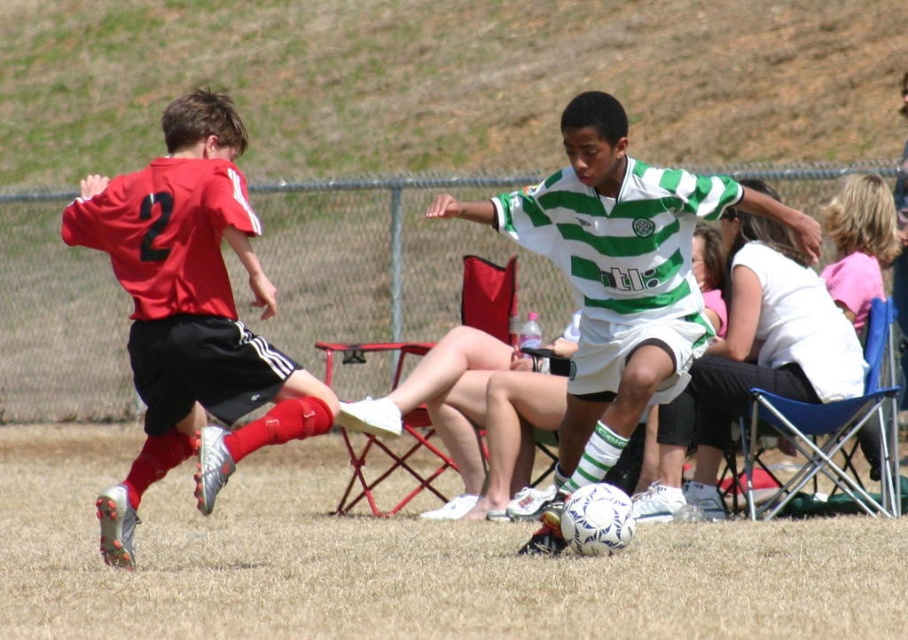
Question: Can you confirm if white matte soccer ball at center is positioned below matte red jersey at left?

Choices:
 (A) no
 (B) yes

Answer: (A)

Question: Estimate the real-world distances between objects in this image. Which object is farther from the matte red jersey at left?

Choices:
 (A) white matte soccer ball at center
 (B) green striped jersey at center

Answer: (B)

Question: Is white matte soccer ball at center closer to camera compared to matte red jersey at left?

Choices:
 (A) yes
 (B) no

Answer: (B)

Question: Which object appears farthest from the camera in this image?

Choices:
 (A) green striped jersey at center
 (B) matte red jersey at left
 (C) white matte soccer ball at center

Answer: (C)

Question: Is white matte soccer ball at center wider than matte red jersey at left?

Choices:
 (A) no
 (B) yes

Answer: (B)

Question: Which point is farther from the camera taking this photo?

Choices:
 (A) (673, 193)
 (B) (555, 477)

Answer: (B)